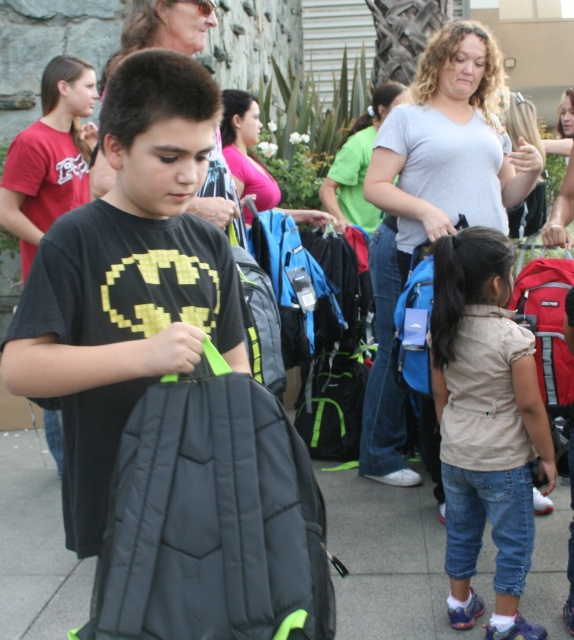
Question: Considering the real-world distances, which object is closest to the matte black backpack at center?

Choices:
 (A) gray fabric backpack at lower center
 (B) denim pants at lower right
 (C) black quilted backpack at center
 (D) red fabric backpack at lower right

Answer: (C)

Question: Can you confirm if denim pants at lower right is bigger than red fabric backpack at lower right?

Choices:
 (A) yes
 (B) no

Answer: (A)

Question: Among these points, which one is nearest to the camera?

Choices:
 (A) (329, 614)
 (B) (424, 225)
 (C) (441, 387)

Answer: (A)

Question: Which point is closer to the camera?

Choices:
 (A) denim pants at lower right
 (B) gray fabric backpack at lower center

Answer: (A)

Question: Where is denim pants at lower right located in relation to matte black hair at upper center in the image?

Choices:
 (A) above
 (B) below

Answer: (B)

Question: Is denim pants at lower right to the left of red fabric backpack at lower right from the viewer's perspective?

Choices:
 (A) yes
 (B) no

Answer: (A)